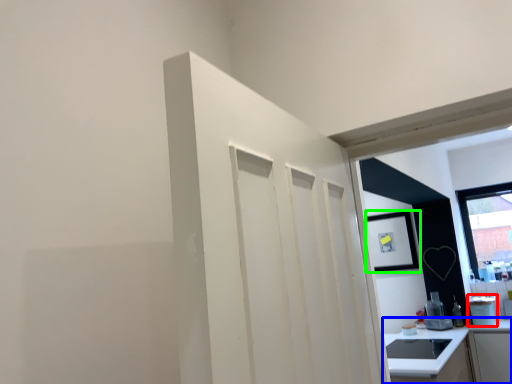
Question: Which object is the farthest from appliance (highlighted by a red box)? Choose among these: countertop (highlighted by a blue box) or picture frame (highlighted by a green box).

Choices:
 (A) countertop
 (B) picture frame

Answer: (A)